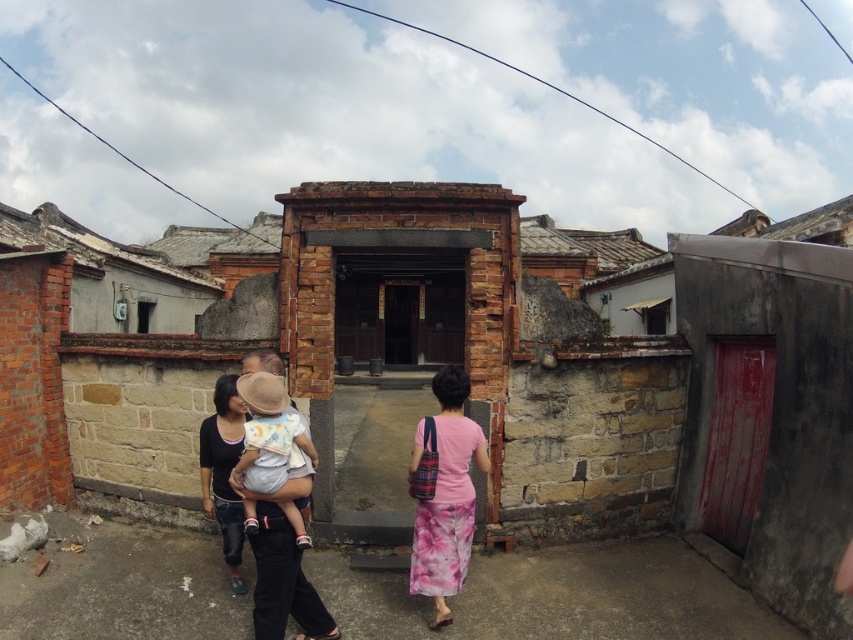
Question: Which of the following is the farthest from the observer?

Choices:
 (A) (265, 480)
 (B) (270, 580)
 (C) (428, 554)

Answer: (C)

Question: Among these points, which one is nearest to the camera?

Choices:
 (A) (279, 426)
 (B) (419, 577)
 (C) (264, 557)

Answer: (A)

Question: Does matte black shirt at center appear over pink fabric dress at center?

Choices:
 (A) yes
 (B) no

Answer: (B)

Question: Which object is farther from the camera taking this photo?

Choices:
 (A) pink fabric dress at center
 (B) matte black shirt at center

Answer: (A)

Question: From the image, what is the correct spatial relationship of matte black shirt at center in relation to light beige cotton baby at center?

Choices:
 (A) right
 (B) left

Answer: (B)

Question: Does matte black shirt at center appear under pink fabric dress at center?

Choices:
 (A) no
 (B) yes

Answer: (B)